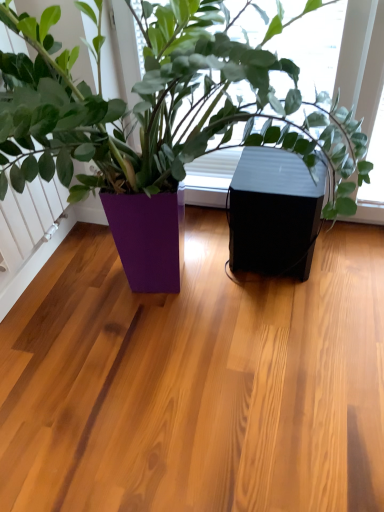
Question: Which is correct: black matte speaker at center is inside purple glossy planter at center, or outside of it?

Choices:
 (A) inside
 (B) outside

Answer: (A)

Question: Is point (258, 203) positioned closer to the camera than point (150, 53)?

Choices:
 (A) farther
 (B) closer

Answer: (A)

Question: In terms of height, does black matte speaker at center look taller or shorter compared to purple glossy planter at center?

Choices:
 (A) short
 (B) tall

Answer: (A)

Question: Is purple glossy planter at center spatially inside black matte speaker at center, or outside of it?

Choices:
 (A) outside
 (B) inside

Answer: (A)

Question: In the image, is purple glossy planter at center positioned in front of or behind black matte speaker at center?

Choices:
 (A) behind
 (B) front

Answer: (B)

Question: From a real-world perspective, is purple glossy planter at center positioned above or below black matte speaker at center?

Choices:
 (A) above
 (B) below

Answer: (A)

Question: Based on their positions, is purple glossy planter at center located to the left or right of black matte speaker at center?

Choices:
 (A) right
 (B) left

Answer: (B)